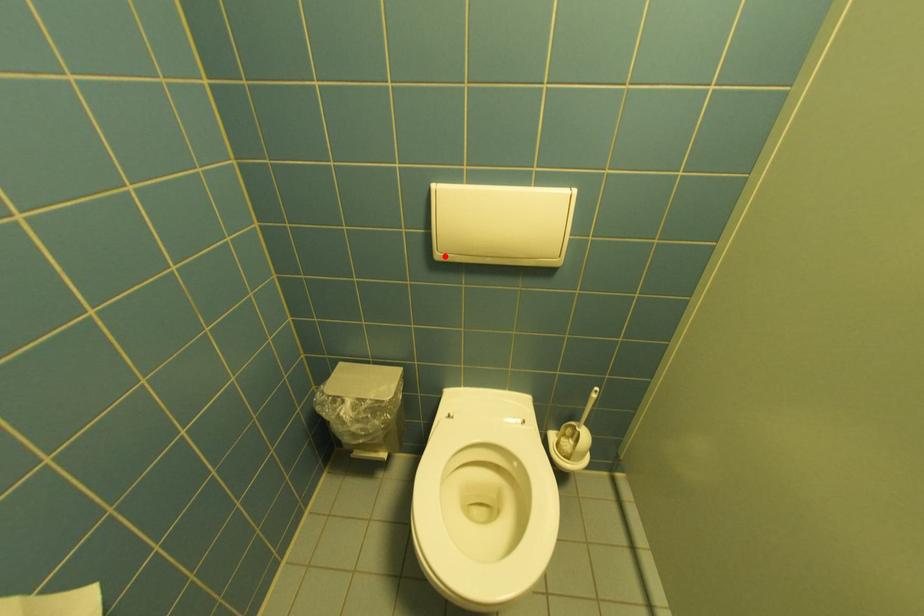
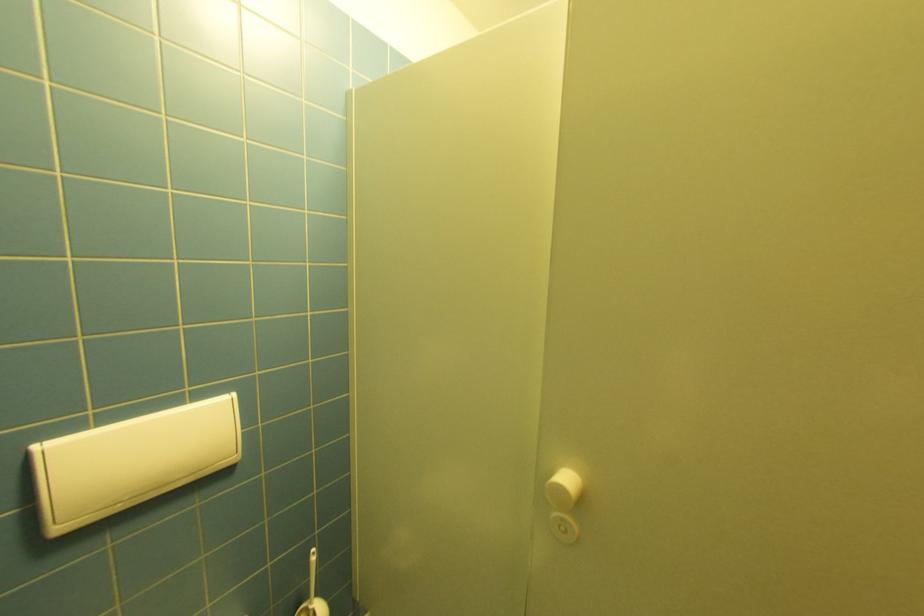
The point at the highlighted location is marked in the first image. Where is the corresponding point in the second image?

(66, 530)